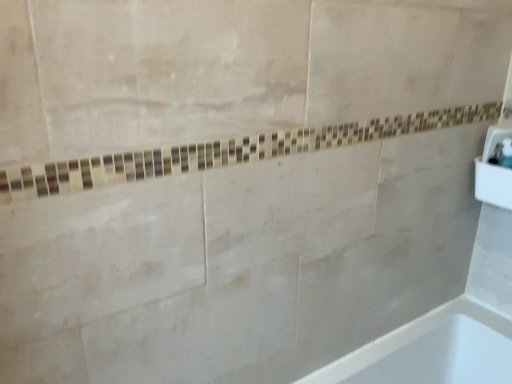
In order to face white glossy sink at right, should I rotate leftwards or rightwards?

To align with it, rotate right about 29.948°.

Locate an element on the screen. white glossy sink at right is located at coordinates (495, 167).

What do you see at coordinates (495, 167) in the screenshot? This screenshot has width=512, height=384. I see `white glossy sink at right` at bounding box center [495, 167].

At what (x,y) coordinates should I click in order to perform the action: click on white glossy sink at right. Please return your answer as a coordinate pair (x, y). The width and height of the screenshot is (512, 384). Looking at the image, I should click on coord(495,167).